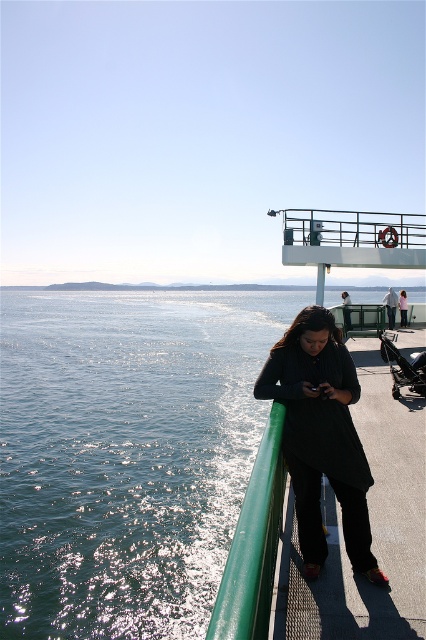
Question: Considering the real-world distances, which object is farthest from the green rubber rail at lower center?

Choices:
 (A) dark gray sweater at center
 (B) black matte dress at center
 (C) shiny blue water at left

Answer: (C)

Question: Is green rubber rail at lower center closer to the viewer compared to dark gray sweater at center?

Choices:
 (A) no
 (B) yes

Answer: (B)

Question: Can you confirm if black matte dress at center is positioned below green rubber rail at lower center?

Choices:
 (A) yes
 (B) no

Answer: (B)

Question: Does shiny blue water at left appear under black matte dress at center?

Choices:
 (A) yes
 (B) no

Answer: (B)

Question: Which object is positioned closest to the black matte dress at center?

Choices:
 (A) green rubber rail at lower center
 (B) shiny blue water at left
 (C) dark gray sweater at center

Answer: (A)

Question: Which point appears farthest from the camera in this image?

Choices:
 (A) (385, 301)
 (B) (339, 346)

Answer: (A)